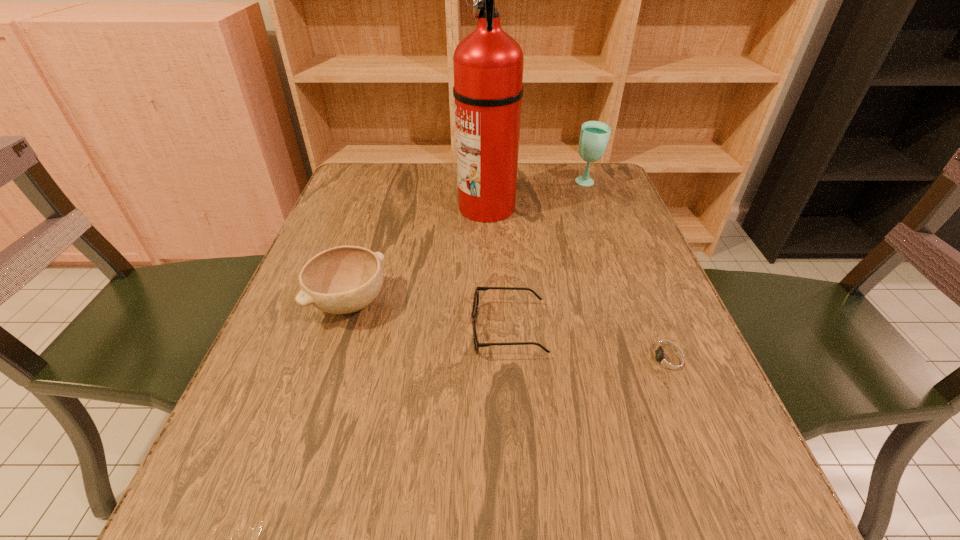
The width and height of the screenshot is (960, 540). In order to click on glass located at the right edge in this screenshot , I will do [594, 136].

Identify the location of watch at the right edge. (669, 361).

Locate an element on the screen. This screenshot has height=540, width=960. object that is at the far right corner is located at coordinates (594, 136).

Where is `vacant space at the far edge of the desktop`? The image size is (960, 540). vacant space at the far edge of the desktop is located at coordinates (549, 180).

This screenshot has height=540, width=960. Find the location of `vacant space at the near edge of the desktop`. vacant space at the near edge of the desktop is located at coordinates (620, 489).

In the image, there is a desktop. At what (x,y) coordinates should I click in order to perform the action: click on vacant space at the left edge. Please return your answer as a coordinate pair (x, y). The image size is (960, 540). Looking at the image, I should click on 324,346.

Locate an element on the screen. vacant space at the right edge of the desktop is located at coordinates (691, 390).

At what (x,y) coordinates should I click in order to perform the action: click on vacant space at the near left corner of the desktop. Please return your answer as a coordinate pair (x, y). Looking at the image, I should click on (297, 529).

This screenshot has width=960, height=540. I want to click on vacant space at the near right corner of the desktop, so click(x=716, y=503).

This screenshot has width=960, height=540. I want to click on vacant space in between the second shortest object and the tallest object, so click(497, 268).